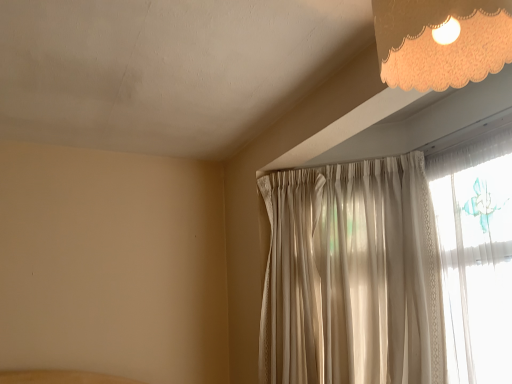
Locate an element on the screen. ivory lace lampshade at upper right is located at coordinates (441, 41).

What do you see at coordinates (441, 41) in the screenshot? The width and height of the screenshot is (512, 384). I see `ivory lace lampshade at upper right` at bounding box center [441, 41].

The height and width of the screenshot is (384, 512). Find the location of `silky white curtain at upper right`. silky white curtain at upper right is located at coordinates (352, 276).

The image size is (512, 384). Describe the element at coordinates (352, 276) in the screenshot. I see `silky white curtain at upper right` at that location.

Where is `ivory lace lampshade at upper right`? ivory lace lampshade at upper right is located at coordinates (441, 41).

Considering the relative positions of ivory lace lampshade at upper right and silky white curtain at upper right in the image provided, is ivory lace lampshade at upper right to the left or to the right of silky white curtain at upper right?

ivory lace lampshade at upper right is to the right of silky white curtain at upper right.

Based on the photo, is ivory lace lampshade at upper right in front of or behind silky white curtain at upper right in the image?

Clearly, ivory lace lampshade at upper right is in front of silky white curtain at upper right.

Looking at this image, which is closer, (x=402, y=56) or (x=266, y=188)?

The point (x=402, y=56) is in front.

From the image's perspective, is ivory lace lampshade at upper right on silky white curtain at upper right?

Indeed, from the image's perspective, ivory lace lampshade at upper right is shown above silky white curtain at upper right.

From a real-world perspective, is ivory lace lampshade at upper right physically located above or below silky white curtain at upper right?

Clearly, from a real-world perspective, ivory lace lampshade at upper right is above silky white curtain at upper right.

Which object is wider, ivory lace lampshade at upper right or silky white curtain at upper right?

silky white curtain at upper right is wider.

Which of these two, ivory lace lampshade at upper right or silky white curtain at upper right, stands taller?

silky white curtain at upper right is taller.

Who is bigger, ivory lace lampshade at upper right or silky white curtain at upper right?

Bigger between the two is silky white curtain at upper right.

Would you say ivory lace lampshade at upper right is inside or outside silky white curtain at upper right?

ivory lace lampshade at upper right is outside silky white curtain at upper right.

Is ivory lace lampshade at upper right positioned far away from silky white curtain at upper right?

ivory lace lampshade at upper right is far away from silky white curtain at upper right.

Is ivory lace lampshade at upper right facing away from silky white curtain at upper right?

No, ivory lace lampshade at upper right is not facing away from silky white curtain at upper right.

The image size is (512, 384). In order to click on lamp located on the right of silky white curtain at upper right in this screenshot , I will do `click(441, 41)`.

Looking at this image, which is more to the right, silky white curtain at upper right or ivory lace lampshade at upper right?

Positioned to the right is ivory lace lampshade at upper right.

Is silky white curtain at upper right further to camera compared to ivory lace lampshade at upper right?

Yes, it is behind ivory lace lampshade at upper right.

Which point is more forward, (283,319) or (502,9)?

The point (502,9) is more forward.

From the image's perspective, which object appears higher, silky white curtain at upper right or ivory lace lampshade at upper right?

From the image's view, ivory lace lampshade at upper right is above.

From a real-world perspective, is silky white curtain at upper right positioned above or below ivory lace lampshade at upper right?

silky white curtain at upper right is below ivory lace lampshade at upper right.

Between silky white curtain at upper right and ivory lace lampshade at upper right, which one has larger width?

silky white curtain at upper right is wider.

Who is taller, silky white curtain at upper right or ivory lace lampshade at upper right?

silky white curtain at upper right is taller.

Does silky white curtain at upper right have a smaller size compared to ivory lace lampshade at upper right?

No, silky white curtain at upper right is not smaller than ivory lace lampshade at upper right.

Would you say ivory lace lampshade at upper right is part of silky white curtain at upper right's contents?

No, ivory lace lampshade at upper right is located outside of silky white curtain at upper right.

Is silky white curtain at upper right next to ivory lace lampshade at upper right and touching it?

No.

Is ivory lace lampshade at upper right at the back of silky white curtain at upper right?

silky white curtain at upper right is not turned away from ivory lace lampshade at upper right.

Can you tell me how much silky white curtain at upper right and ivory lace lampshade at upper right differ in facing direction?

51.1 degrees.

How much distance is there between silky white curtain at upper right and ivory lace lampshade at upper right?

silky white curtain at upper right and ivory lace lampshade at upper right are 3.61 feet apart.

At what (x,y) coordinates should I click in order to perform the action: click on lamp that is in front of the silky white curtain at upper right. Please return your answer as a coordinate pair (x, y). The image size is (512, 384). Looking at the image, I should click on (441, 41).

Where is `lamp in front of the silky white curtain at upper right`? lamp in front of the silky white curtain at upper right is located at coordinates (441, 41).

You are a GUI agent. You are given a task and a screenshot of the screen. Output one action in this format:
    pyautogui.click(x=<x>, y=<y>)
    Task: Click on the lamp above the silky white curtain at upper right (from a real-world perspective)
    This screenshot has height=384, width=512.
    Given the screenshot: What is the action you would take?
    pyautogui.click(x=441, y=41)